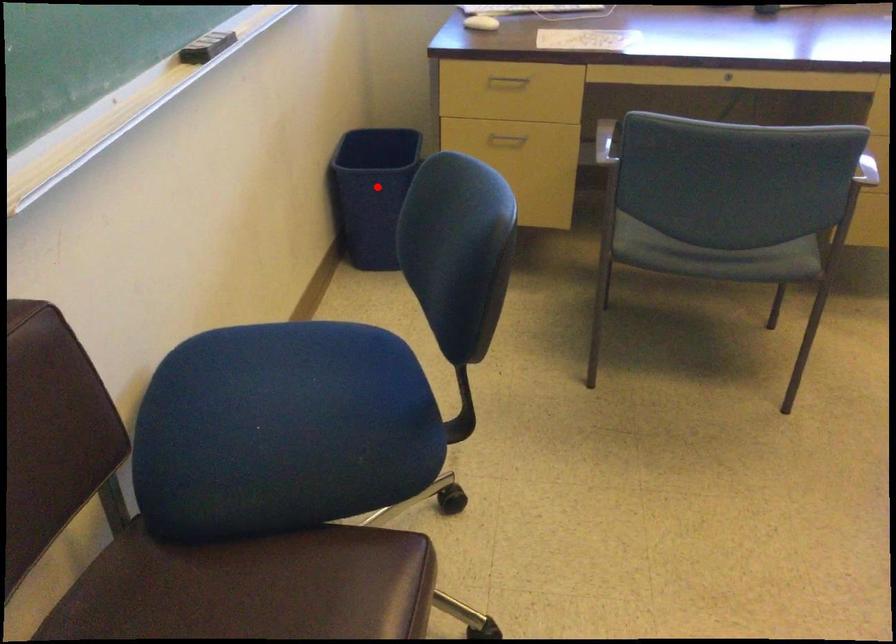
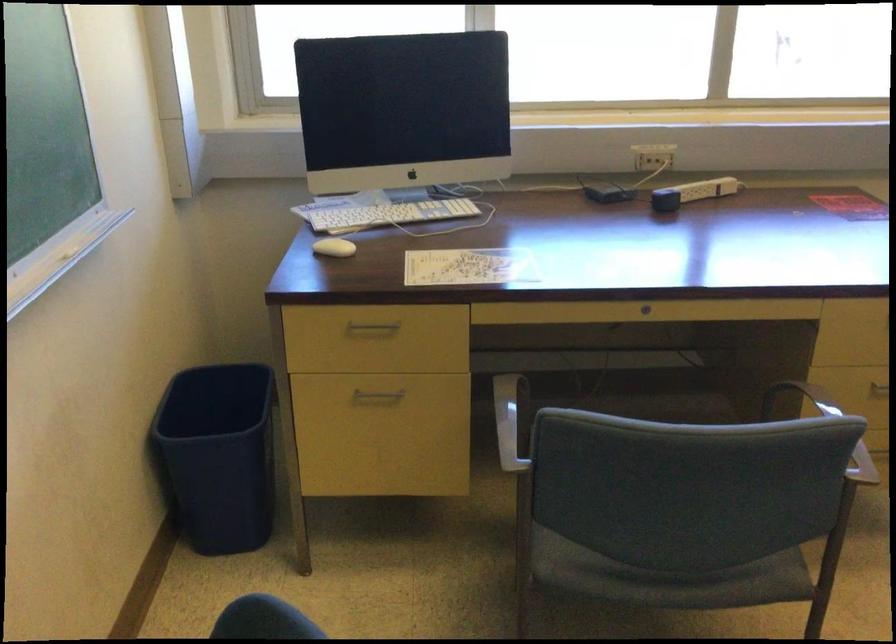
Question: I am providing you with two images of the same scene from different viewpoints. A red point is shown in image1. For the corresponding object point in image2, is it positioned nearer or farther from the camera?

Choices:
 (A) Nearer
 (B) Farther

Answer: (A)